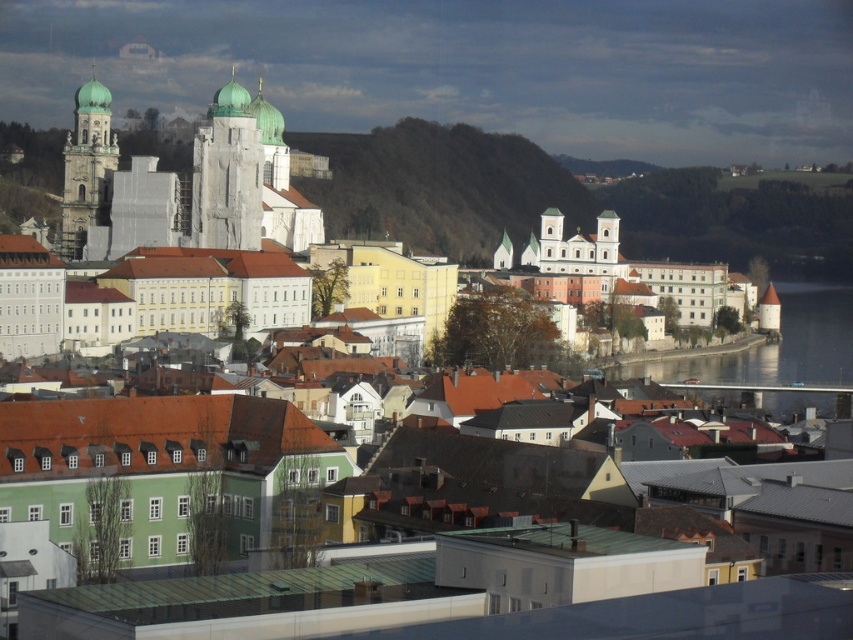
Is bare earth hillside at center positioned behind white stone tower at center?

Yes, it is behind white stone tower at center.

Does bare earth hillside at center have a larger size compared to white stone tower at center?

Indeed, bare earth hillside at center has a larger size compared to white stone tower at center.

Which is in front, point (489, 253) or point (239, 179)?

Positioned in front is point (239, 179).

The image size is (853, 640). Find the location of `bare earth hillside at center`. bare earth hillside at center is located at coordinates (440, 188).

Which is more to the right, bare earth hillside at center or matte white tower at left?

Positioned to the right is bare earth hillside at center.

Is bare earth hillside at center smaller than matte white tower at left?

Actually, bare earth hillside at center might be larger than matte white tower at left.

Between point (386, 225) and point (82, 156), which one is positioned behind?

The point (386, 225) is behind.

Find the location of a particular element. The width and height of the screenshot is (853, 640). bare earth hillside at center is located at coordinates (440, 188).

Is bare earth hillside at center bigger than transparent glass water at river right?

No, bare earth hillside at center is not bigger than transparent glass water at river right.

Between point (494, 177) and point (775, 403), which one is positioned in front?

Positioned in front is point (775, 403).

The width and height of the screenshot is (853, 640). I want to click on bare earth hillside at center, so click(x=440, y=188).